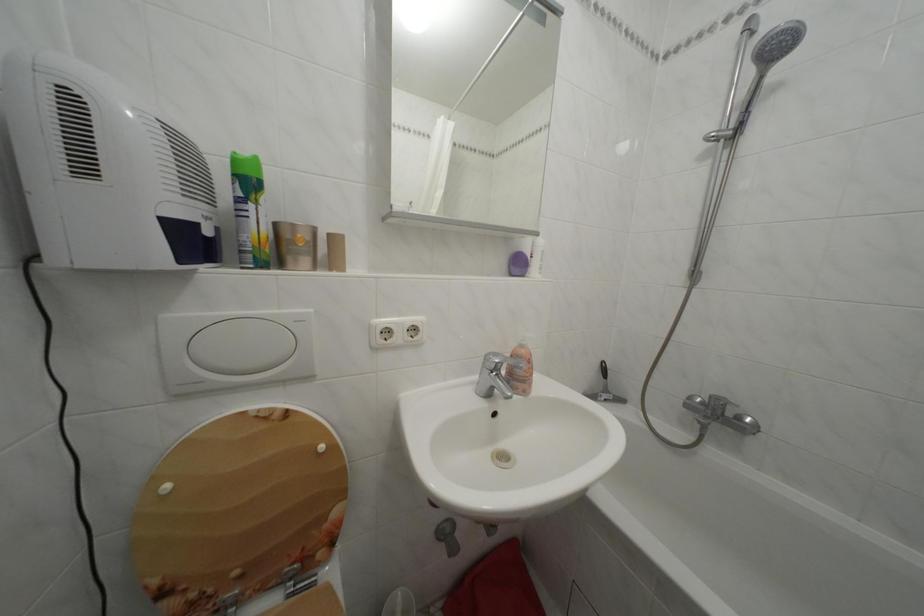
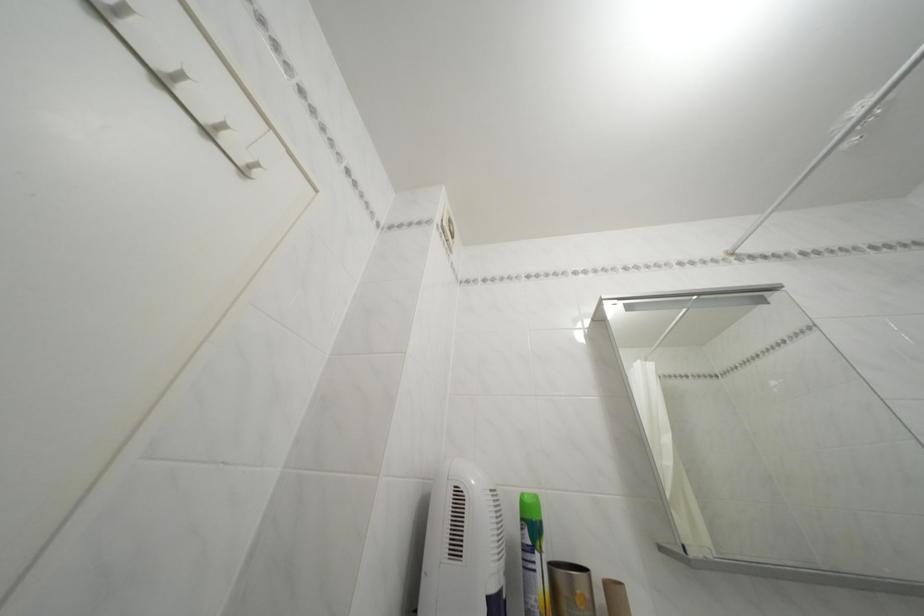
Where in the second image is the point corresponding to (x=260, y=213) from the first image?

(545, 562)